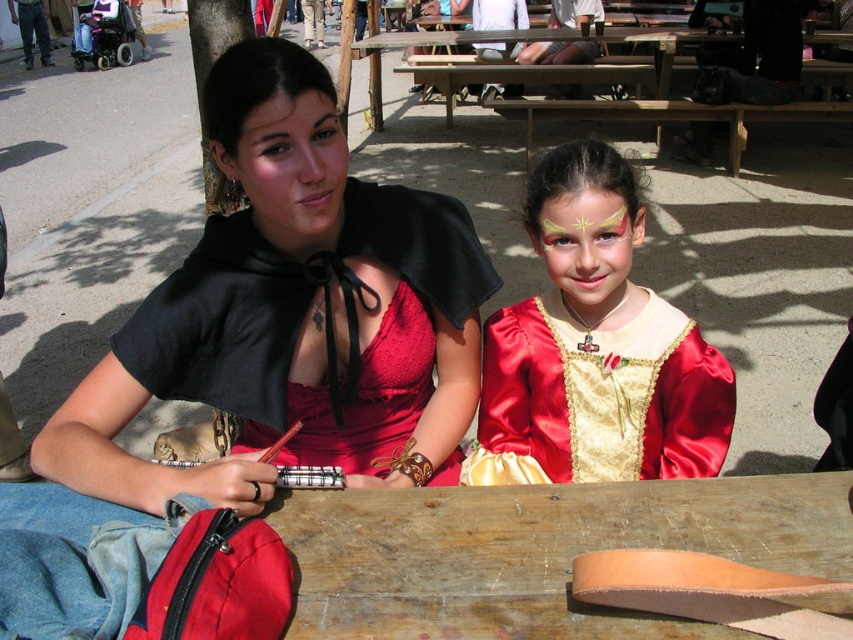
How far apart are satin gold dress at center and matte black cape at upper center?

satin gold dress at center and matte black cape at upper center are 19.79 inches apart from each other.

Is satin gold dress at center behind matte black cape at upper center?

Yes, it is behind matte black cape at upper center.

Image resolution: width=853 pixels, height=640 pixels. I want to click on satin gold dress at center, so click(x=595, y=348).

This screenshot has height=640, width=853. What are the coordinates of `satin gold dress at center` in the screenshot? It's located at (595, 348).

Is matte black cape at upper left taller than wooden at center?

Yes.

Is matte black cape at upper left shorter than wooden at center?

No, matte black cape at upper left is not shorter than wooden at center.

The image size is (853, 640). What do you see at coordinates (276, 292) in the screenshot?
I see `matte black cape at upper left` at bounding box center [276, 292].

Locate an element on the screen. The width and height of the screenshot is (853, 640). matte black cape at upper left is located at coordinates (276, 292).

Which is below, matte black cape at upper left or satin gold dress at center?

Positioned lower is satin gold dress at center.

Looking at this image, can you confirm if matte black cape at upper left is wider than satin gold dress at center?

Indeed, matte black cape at upper left has a greater width compared to satin gold dress at center.

This screenshot has width=853, height=640. What are the coordinates of `matte black cape at upper left` in the screenshot? It's located at (276, 292).